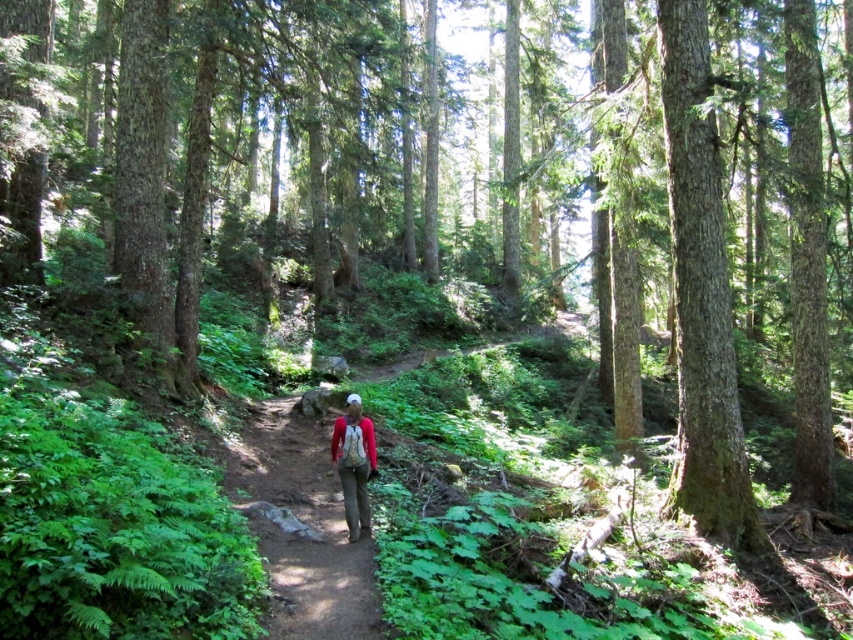
You are hiking on a dirt path through the forest and see a smooth brown tree trunk at right and a matte red shirt at center. Which object is closer to you?

The smooth brown tree trunk at right is closer to you because it is further to the viewer than the matte red shirt at center.

You are a hiker wearing a matte red shirt at center and you see a brown dirt trail at center. Which object is closer to the ground?

The brown dirt trail at center is closer to the ground because it is located below the matte red shirt at center.

You are standing at the point with coordinates point [355,436] and want to walk towards the point with coordinates point [730,531]. Based on the forest terrain described, will you be able to see the point you are walking towards once you start moving forward?

Point [730,531] is behind point [355,436], so you will not be able to see the point you are walking towards once you start moving forward because it is obscured by the forest terrain between them.